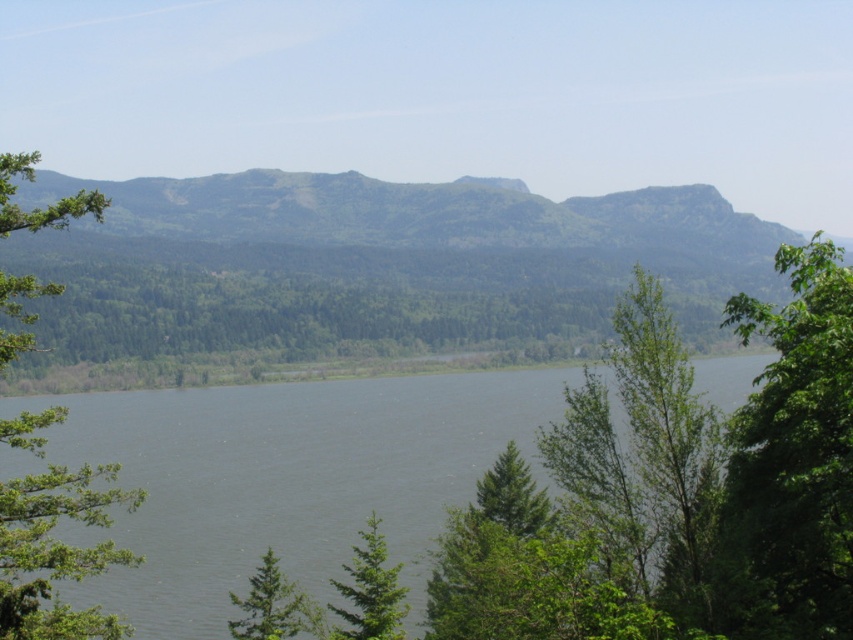
Question: Among these points, which one is nearest to the camera?

Choices:
 (A) (689, 515)
 (B) (236, 634)

Answer: (A)

Question: Which is nearer to the green leafy tree at right?

Choices:
 (A) green leafy tree at left
 (B) gray water at center

Answer: (A)

Question: Does green leafy tree at center-right have a greater width compared to green matte tree at center?

Choices:
 (A) yes
 (B) no

Answer: (A)

Question: Does green leafy tree at left lie in front of green matte tree at center?

Choices:
 (A) no
 (B) yes

Answer: (B)

Question: Does green leafy tree at center-right appear over green matte tree at center?

Choices:
 (A) no
 (B) yes

Answer: (B)

Question: Among these objects, which one is nearest to the camera?

Choices:
 (A) green leafy tree at center-right
 (B) green matte tree at lower center
 (C) green leafy tree at right
 (D) green leafy tree at left

Answer: (C)